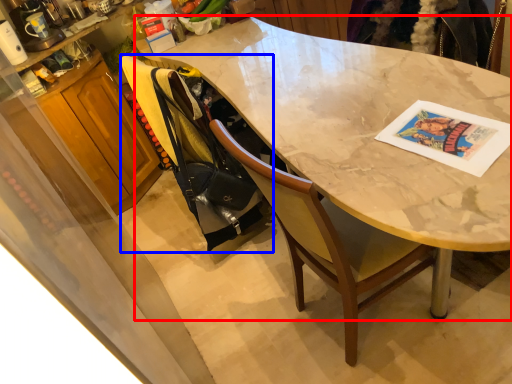
Question: Among these objects, which one is farthest to the camera, desk (highlighted by a red box) or handbag (highlighted by a blue box)?

Choices:
 (A) desk
 (B) handbag

Answer: (B)